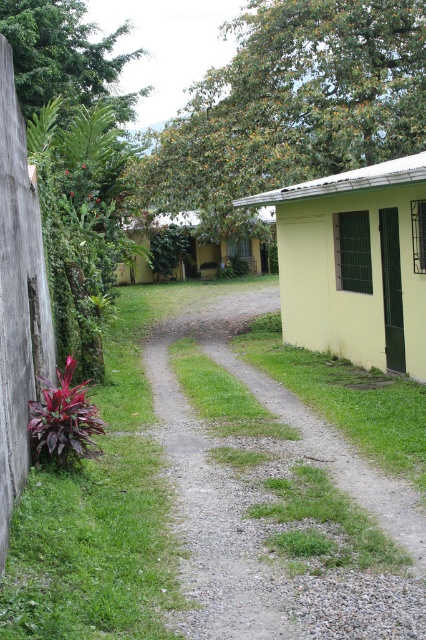
Question: Which point is farther from the camera taking this photo?

Choices:
 (A) (212, 337)
 (B) (241, 246)
 (C) (305, 128)

Answer: (B)

Question: Does green leafy tree at upper left have a greater width compared to green matte hut at center?

Choices:
 (A) yes
 (B) no

Answer: (B)

Question: Is green leafy tree at upper center thinner than light yellow wall at center?

Choices:
 (A) no
 (B) yes

Answer: (A)

Question: Which point appears closest to the camera in this image?

Choices:
 (A) (374, 474)
 (B) (43, 28)
 (C) (389, 346)
 (D) (247, 106)

Answer: (A)

Question: Can you confirm if green leafy tree at upper left is bigger than green matte hut at center?

Choices:
 (A) no
 (B) yes

Answer: (B)

Question: Estimate the real-world distances between objects in this image. Which object is closer to the green leafy tree at upper left?

Choices:
 (A) gravel path at center
 (B) green leafy tree at upper center
 (C) light yellow wall at center
 (D) green matte hut at center

Answer: (D)